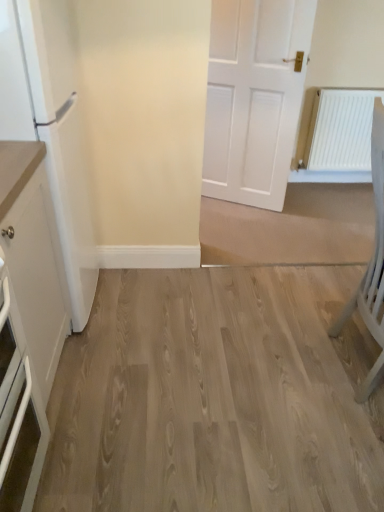
This screenshot has height=512, width=384. In order to click on vacant area that lies in front of white matte radiator at right in this screenshot , I will do `click(339, 198)`.